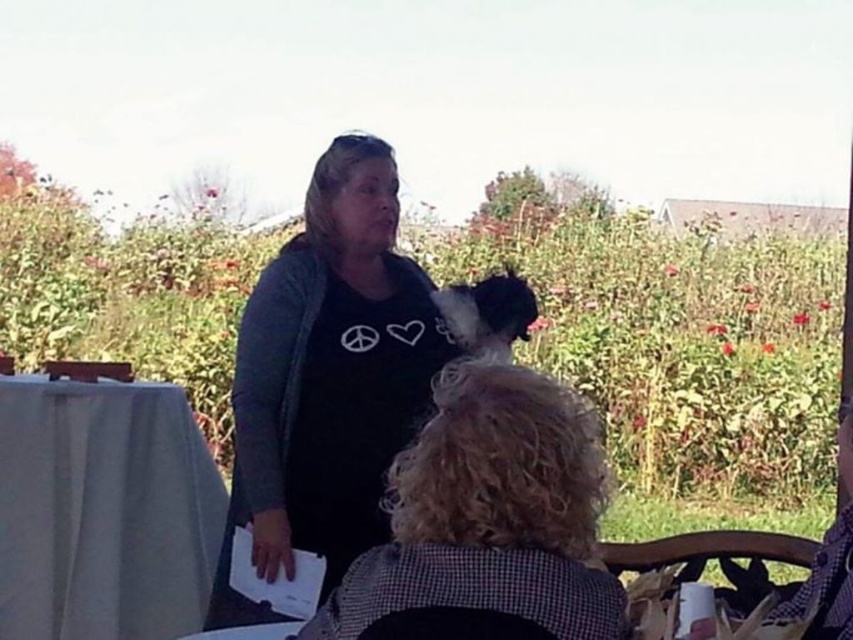
Is black matte shirt at center taller than white cloth at left?

Indeed, black matte shirt at center has a greater height compared to white cloth at left.

This screenshot has width=853, height=640. What do you see at coordinates (328, 378) in the screenshot?
I see `black matte shirt at center` at bounding box center [328, 378].

Does point (277, 544) come behind point (123, 394)?

No, it is in front of (123, 394).

Locate an element on the screen. This screenshot has height=640, width=853. black matte shirt at center is located at coordinates (328, 378).

Is the position of white cloth at left more distant than that of black fur dog at center?

Yes.

Is white cloth at left wider than black fur dog at center?

Yes.

Who is more forward, (94, 605) or (492, 321)?

Point (492, 321) is in front.

Find the location of `white cloth at left`. white cloth at left is located at coordinates (103, 509).

Which of these two, black matte shirt at center or black cotton shirt at center, stands shorter?

black cotton shirt at center is shorter.

In the scene shown: Does black matte shirt at center have a smaller size compared to black cotton shirt at center?

Incorrect, black matte shirt at center is not smaller in size than black cotton shirt at center.

Who is more distant from viewer, [415,352] or [596,492]?

The point [415,352] is more distant.

Locate an element on the screen. Image resolution: width=853 pixels, height=640 pixels. black matte shirt at center is located at coordinates pos(328,378).